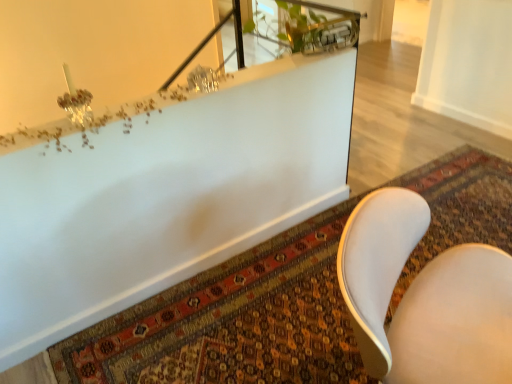
Find the location of `white glossy bathtub at upper center`. white glossy bathtub at upper center is located at coordinates pyautogui.click(x=163, y=192).

The image size is (512, 384). I want to click on white leather chair at lower right, so [x=424, y=298].

Can you tell me how much white leather chair at lower right and carpeted mat at lower center differ in facing direction?

The angle between the facing direction of white leather chair at lower right and the facing direction of carpeted mat at lower center is 153 degrees.

Is white leather chair at lower right directly adjacent to carpeted mat at lower center?

white leather chair at lower right is not next to carpeted mat at lower center, and they're not touching.

Considering the points (404, 261) and (495, 181), which point is behind, point (404, 261) or point (495, 181)?

The point (495, 181) is behind.

From the image's perspective, which object appears higher, white leather chair at lower right or carpeted mat at lower center?

carpeted mat at lower center is shown above in the image.

Looking at this image, considering the relative sizes of carpeted mat at lower center and white leather chair at lower right in the image provided, is carpeted mat at lower center bigger than white leather chair at lower right?

Actually, carpeted mat at lower center might be smaller than white leather chair at lower right.

From the image's perspective, would you say carpeted mat at lower center is positioned over white leather chair at lower right?

Indeed, from the image's perspective, carpeted mat at lower center is shown above white leather chair at lower right.

Considering the positions of objects carpeted mat at lower center and white leather chair at lower right in the image provided, who is more to the right, carpeted mat at lower center or white leather chair at lower right?

carpeted mat at lower center is more to the right.

Relative to white leather chair at lower right, is carpeted mat at lower center in front or behind?

carpeted mat at lower center is positioned farther from the viewer than white leather chair at lower right.

From the picture: From a real-world perspective, who is located lower, white glossy bathtub at upper center or white leather chair at lower right?

white glossy bathtub at upper center.

The height and width of the screenshot is (384, 512). What are the coordinates of `chair in front of the white glossy bathtub at upper center` in the screenshot? It's located at (424, 298).

Which is behind, point (287, 153) or point (382, 267)?

The point (287, 153) is farther.

Is white glossy bathtub at upper center placed right next to carpeted mat at lower center?

white glossy bathtub at upper center and carpeted mat at lower center are clearly separated.

From a real-world perspective, is white glossy bathtub at upper center on carpeted mat at lower center?

No.

Is white glossy bathtub at upper center shorter than carpeted mat at lower center?

Incorrect, the height of white glossy bathtub at upper center does not fall short of that of carpeted mat at lower center.

From the image's perspective, would you say white glossy bathtub at upper center is shown under carpeted mat at lower center?

No.

Who is shorter, carpeted mat at lower center or white glossy bathtub at upper center?

carpeted mat at lower center is shorter.

Is carpeted mat at lower center situated inside white glossy bathtub at upper center or outside?

carpeted mat at lower center is contained in white glossy bathtub at upper center.

Which is more to the left, carpeted mat at lower center or white glossy bathtub at upper center?

Positioned to the left is white glossy bathtub at upper center.

From the image's perspective, is carpeted mat at lower center beneath white glossy bathtub at upper center?

Yes, from the image's perspective, carpeted mat at lower center is beneath white glossy bathtub at upper center.

Is point (503, 270) positioned in front of point (88, 176)?

Yes.

Considering the sizes of white leather chair at lower right and white glossy bathtub at upper center in the image, is white leather chair at lower right wider or thinner than white glossy bathtub at upper center?

In the image, white leather chair at lower right appears to be more narrow than white glossy bathtub at upper center.

Is the surface of white leather chair at lower right in direct contact with white glossy bathtub at upper center?

They are not placed beside each other.

Can you confirm if white leather chair at lower right is taller than white glossy bathtub at upper center?

Correct, white leather chair at lower right is much taller as white glossy bathtub at upper center.

Locate an element on the screen. The height and width of the screenshot is (384, 512). mat located on the right of white leather chair at lower right is located at coordinates (285, 296).

This screenshot has height=384, width=512. Identify the location of chair located in front of the carpeted mat at lower center. (424, 298).

Which object lies further to the anchor point white leather chair at lower right, white glossy bathtub at upper center or carpeted mat at lower center?

Based on the image, white glossy bathtub at upper center appears to be further to white leather chair at lower right.

Consider the image. When comparing their distances from carpeted mat at lower center, does white glossy bathtub at upper center or white leather chair at lower right seem further?

white leather chair at lower right is further to carpeted mat at lower center.

Estimate the real-world distances between objects in this image. Which object is further from white leather chair at lower right, carpeted mat at lower center or white glossy bathtub at upper center?

The object further to white leather chair at lower right is white glossy bathtub at upper center.

Based on their spatial positions, is white leather chair at lower right or carpeted mat at lower center further from white glossy bathtub at upper center?

Among the two, white leather chair at lower right is located further to white glossy bathtub at upper center.

In the scene shown: Which object lies nearer to the anchor point white glossy bathtub at upper center, carpeted mat at lower center or white leather chair at lower right?

carpeted mat at lower center is closer to white glossy bathtub at upper center.

Based on their spatial positions, is white leather chair at lower right or white glossy bathtub at upper center closer to carpeted mat at lower center?

white glossy bathtub at upper center is closer to carpeted mat at lower center.

Where is `mat between white glossy bathtub at upper center and white leather chair at lower right vertically`? This screenshot has width=512, height=384. mat between white glossy bathtub at upper center and white leather chair at lower right vertically is located at coordinates (285, 296).